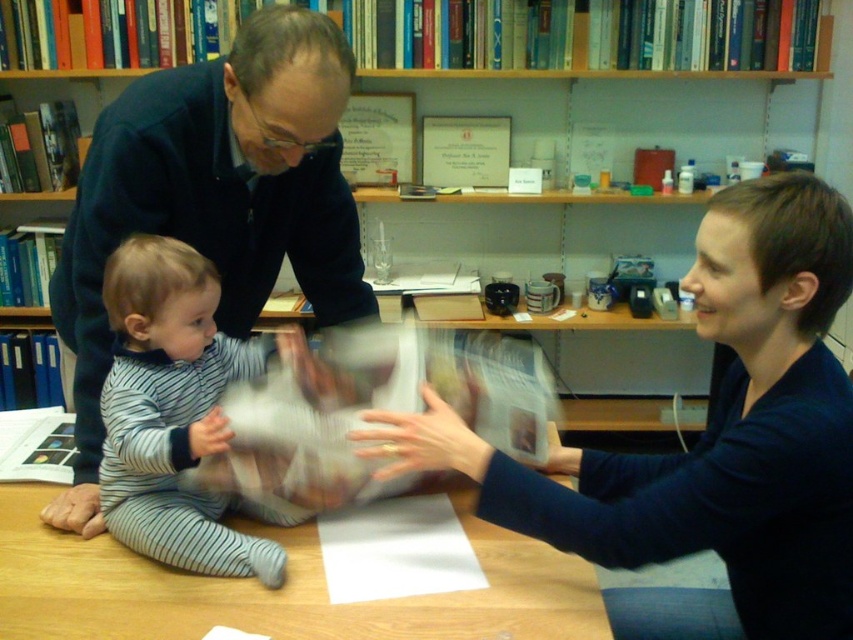
Can you confirm if dark blue sweater at center is positioned to the left of striped cotton onesie at center?

No, dark blue sweater at center is not to the left of striped cotton onesie at center.

Which of these two, dark blue sweater at center or striped cotton onesie at center, stands shorter?

With less height is striped cotton onesie at center.

Describe the element at coordinates (213, 200) in the screenshot. I see `dark blue sweater at center` at that location.

Where is `dark blue sweater at center`? The image size is (853, 640). dark blue sweater at center is located at coordinates (213, 200).

The width and height of the screenshot is (853, 640). Describe the element at coordinates (202, 211) in the screenshot. I see `wooden bookshelf at upper center` at that location.

I want to click on wooden bookshelf at upper center, so click(x=202, y=211).

This screenshot has height=640, width=853. I want to click on wooden bookshelf at upper center, so click(x=202, y=211).

This screenshot has width=853, height=640. Find the location of `wooden bookshelf at upper center`. wooden bookshelf at upper center is located at coordinates (202, 211).

Is smooth blue sweater at center shorter than wooden table at center?

No.

Does smooth blue sweater at center appear over wooden table at center?

Correct, smooth blue sweater at center is located above wooden table at center.

At what (x,y) coordinates should I click in order to perform the action: click on smooth blue sweater at center. Please return your answer as a coordinate pair (x, y). This screenshot has height=640, width=853. Looking at the image, I should click on (708, 440).

In order to click on smooth blue sweater at center in this screenshot , I will do `click(708, 440)`.